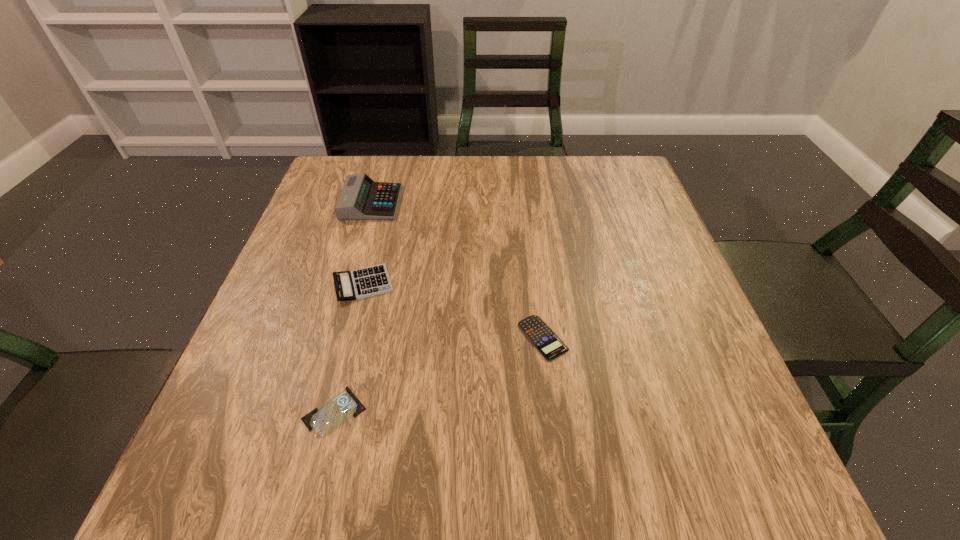
Locate an element on the screen. free point between the nearest object and the tallest object is located at coordinates (353, 307).

Where is `object that is the second closest to the second nearest calculator`? Image resolution: width=960 pixels, height=540 pixels. object that is the second closest to the second nearest calculator is located at coordinates (323, 421).

Point out which object is positioned as the second nearest to the second farthest calculator. Please provide its 2D coordinates. Your answer should be formatted as a tuple, i.e. [(x, y)], where the tuple contains the x and y coordinates of a point satisfying the conditions above.

[(323, 421)]

The height and width of the screenshot is (540, 960). I want to click on the second closest calculator to the tallest object, so click(550, 346).

Locate which calculator ranks second in proximity to the second tallest calculator. Please provide its 2D coordinates. Your answer should be formatted as a tuple, i.e. [(x, y)], where the tuple contains the x and y coordinates of a point satisfying the conditions above.

[(550, 346)]

Find the location of `vacant point that satisfies the following two spatial constraints: 1. on the back side of the nearest calculator; 2. on the left side of the identity card`. vacant point that satisfies the following two spatial constraints: 1. on the back side of the nearest calculator; 2. on the left side of the identity card is located at coordinates (353, 338).

You are a GUI agent. You are given a task and a screenshot of the screen. Output one action in this format:
    pyautogui.click(x=<x>, y=<y>)
    Task: Click on the free region that satisfies the following two spatial constraints: 1. on the back side of the rightmost object; 2. on the left side of the shortest object
    Image resolution: width=960 pixels, height=540 pixels.
    Given the screenshot: What is the action you would take?
    [353, 338]

Where is `free location that satisfies the following two spatial constraints: 1. on the front side of the third farthest object; 2. on the right side of the third shortest object`? free location that satisfies the following two spatial constraints: 1. on the front side of the third farthest object; 2. on the right side of the third shortest object is located at coordinates (349, 338).

This screenshot has width=960, height=540. In order to click on free location that satisfies the following two spatial constraints: 1. on the front side of the identity card; 2. on the left side of the second tallest object in this screenshot , I will do `click(330, 411)`.